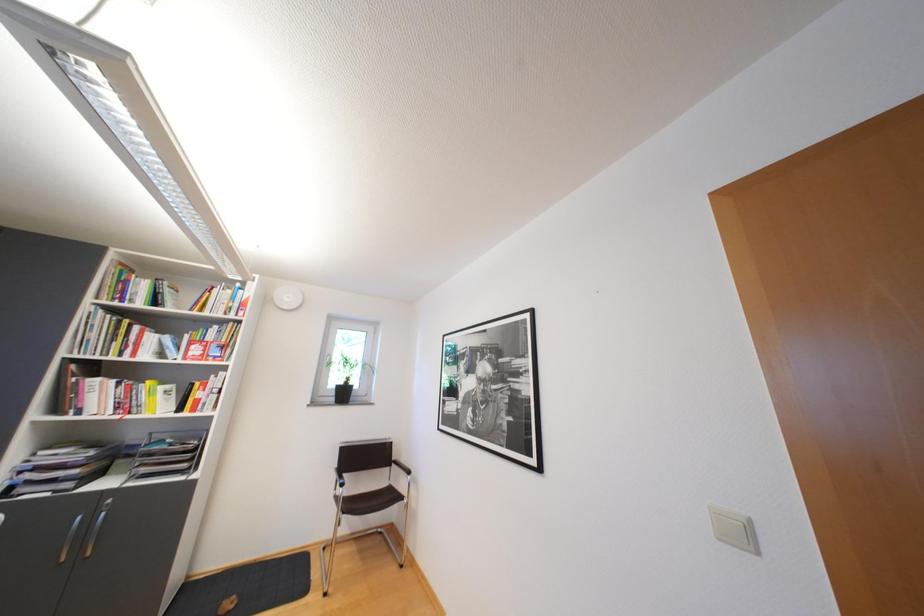
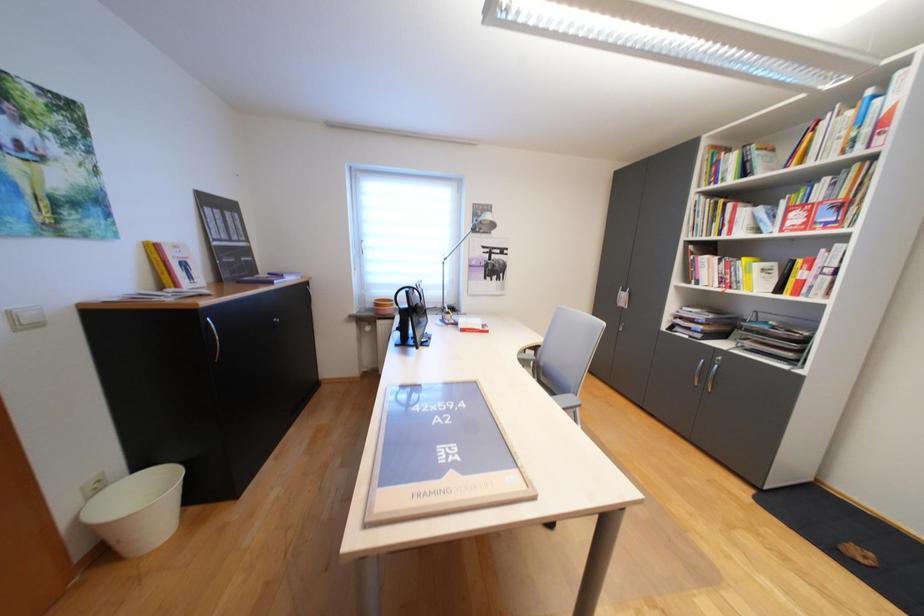
Question: The camera is either moving clockwise (left) or counter-clockwise (right) around the object. The first image is from the beginning of the video and the second image is from the end. Is the camera moving left or right when shooting the video?

Choices:
 (A) Left
 (B) Right

Answer: (B)